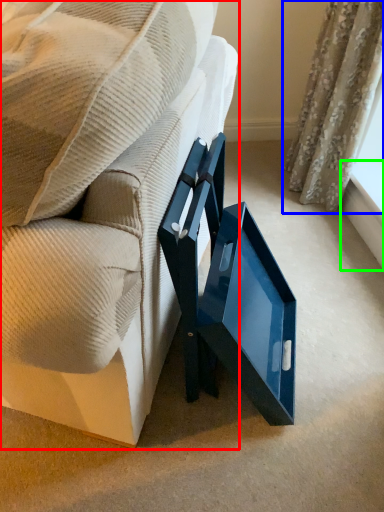
Question: Which is farther away from furniture (highlighted by a red box)? curtain (highlighted by a blue box) or window sill (highlighted by a green box)?

Choices:
 (A) curtain
 (B) window sill

Answer: (B)